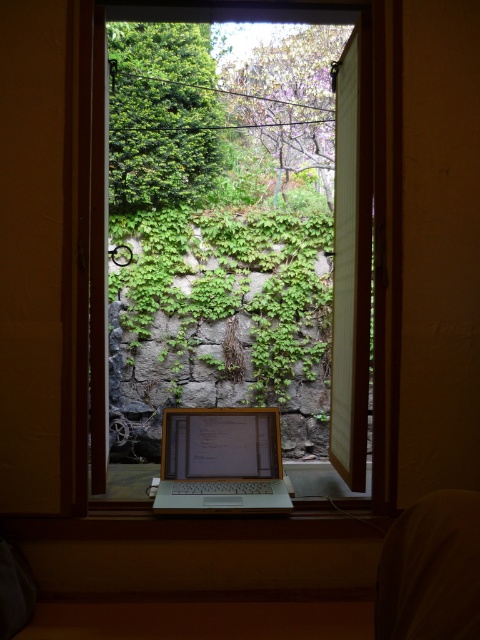
You are standing in the room and see the dark fabric at lower right. If you want to reach it without moving your feet, can you do it?

The dark fabric at lower right and viewer are 38.73 inches apart, so yes, you can reach it without moving your feet since the distance is within arm reach.

You are a delivery robot that needs to place a small package on the dark fabric at lower right. The package is 10 centimeters wide. Can you safely place it there without blocking the view of the laptop screen on the satin silver laptop at center?

The dark fabric at lower right is 95.42 centimeters away from the satin silver laptop at center. Since the package is only 10 centimeters wide, placing it on the dark fabric at lower right would not obstruct the view of the laptop screen as there is sufficient distance between them.